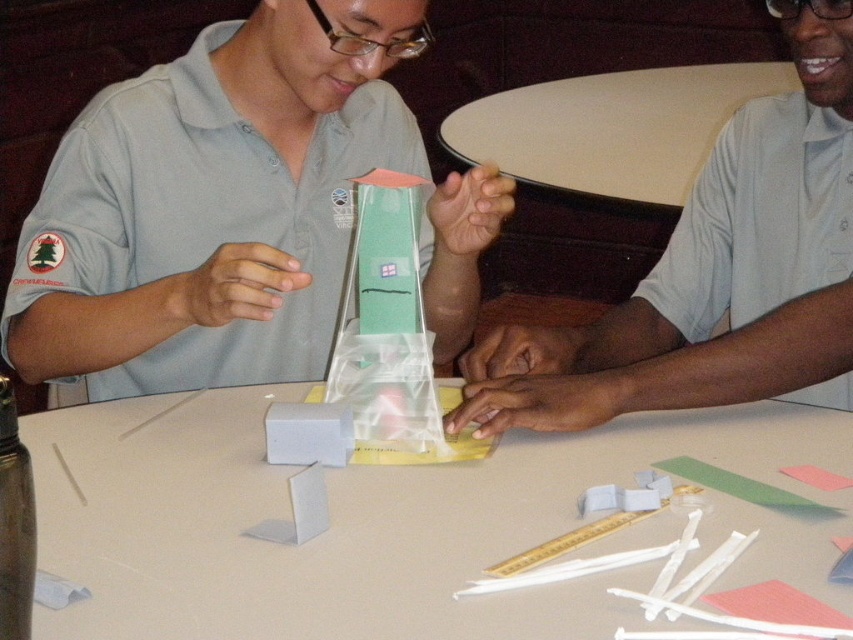
You are organizing a workshop and need to place a 1.2 meter wide poster on the table. Given the dimensions of the white glossy table at upper center and the transparent plastic tower at center, will the poster fit on the table without overlapping the tower?

The white glossy table at upper center is wider than the transparent plastic tower at center. Since the table is wider, the 1.2 meter wide poster should fit on the table without overlapping the tower, provided the table itself is at least 1.2 meters wide.

You are standing 2 meters away from a table where two people are working on a model. There is a point at coordinates point (582, 129) on the table. Can you reach that point without moving closer to the table?

The distance of point (582, 129) from viewer is 2.32 meters. Since you are standing 2 meters away from the table, the point is 0.32 meters further away than your current position. Therefore, you cannot reach the point without moving closer to the table.

You are a participant in a model building workshop and need to place a new accessory on the table. The accessory must be placed between the matte plastic tower at center and the transparent plastic tower at center. However, you can only place it in a spot that is closer to the person on the left. Where should you position the accessory?

The matte plastic tower at center is in front of the transparent plastic tower at center. Since the accessory must be placed between them and closer to the person on the left, position it near the front side of the matte plastic tower at center, closer to the left side of the table.